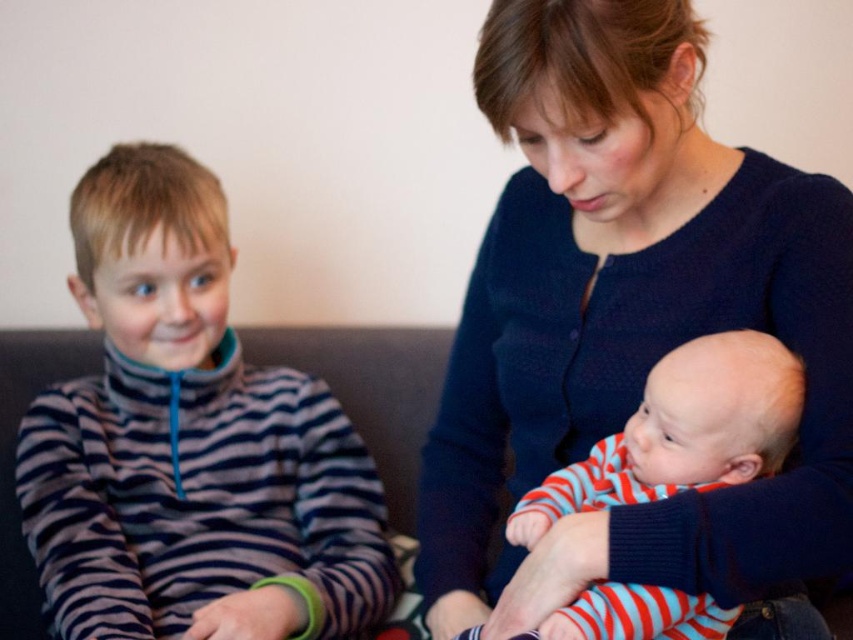
Does striped fabric shirt at left appear over striped cotton baby at center?

Yes, striped fabric shirt at left is above striped cotton baby at center.

Can you confirm if striped fabric shirt at left is thinner than striped cotton baby at center?

No, striped fabric shirt at left is not thinner than striped cotton baby at center.

I want to click on striped fabric shirt at left, so click(x=189, y=444).

You are a GUI agent. You are given a task and a screenshot of the screen. Output one action in this format:
    pyautogui.click(x=<x>, y=<y>)
    Task: Click on the striped fabric shirt at left
    The height and width of the screenshot is (640, 853).
    Given the screenshot: What is the action you would take?
    pyautogui.click(x=189, y=444)

Does blue textured sweater at center have a lesser height compared to striped cotton baby at center?

No, blue textured sweater at center is not shorter than striped cotton baby at center.

Locate an element on the screen. The width and height of the screenshot is (853, 640). blue textured sweater at center is located at coordinates (630, 324).

The width and height of the screenshot is (853, 640). I want to click on blue textured sweater at center, so click(x=630, y=324).

Which is in front, point (821, 221) or point (238, 381)?

Point (821, 221)

Is blue textured sweater at center smaller than striped fabric shirt at left?

No.

Where is `blue textured sweater at center`? This screenshot has width=853, height=640. blue textured sweater at center is located at coordinates (630, 324).